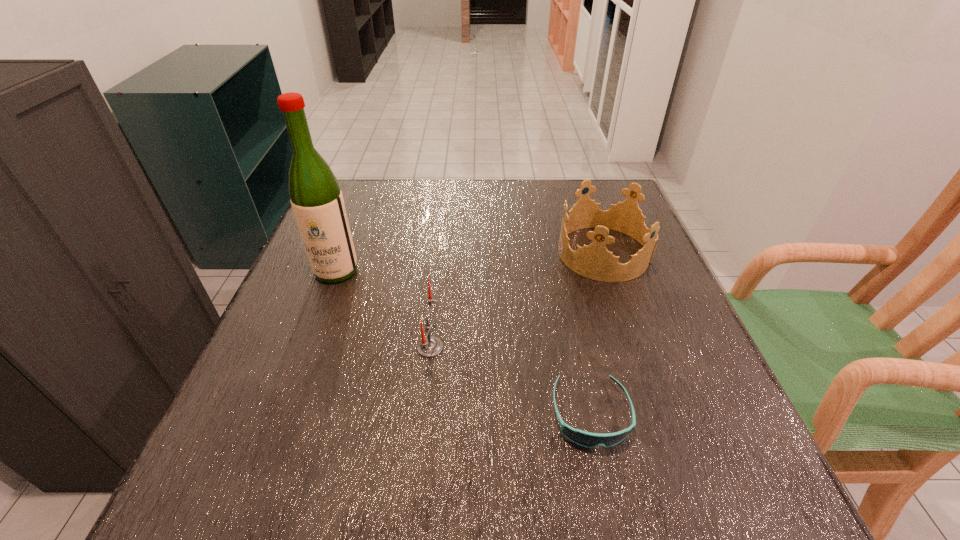
You are a GUI agent. You are given a task and a screenshot of the screen. Output one action in this format:
    pyautogui.click(x=<x>, y=<y>)
    Task: Click on the leftmost object
    Image resolution: width=960 pixels, height=540 pixels.
    Given the screenshot: What is the action you would take?
    pyautogui.click(x=315, y=195)

At what (x,y) coordinates should I click in order to perform the action: click on the tallest object. Please return your answer as a coordinate pair (x, y). The height and width of the screenshot is (540, 960). Looking at the image, I should click on (315, 195).

Locate an element on the screen. Image resolution: width=960 pixels, height=540 pixels. tiara is located at coordinates (594, 261).

I want to click on the second nearest object, so click(429, 346).

Where is `the second object from left to right`? This screenshot has width=960, height=540. the second object from left to right is located at coordinates (429, 346).

Identify the location of sunglasses. (586, 439).

At what (x,y) coordinates should I click in order to perform the action: click on the nearest object. Please return your answer as a coordinate pair (x, y). Looking at the image, I should click on (586, 439).

Where is `vacant position located 0.390m on the label of the liquor`? vacant position located 0.390m on the label of the liquor is located at coordinates (267, 454).

Locate an element on the screen. free region located 0.240m on the front-facing side of the tiara is located at coordinates (459, 253).

Locate an element on the screen. vacant point located on the front-facing side of the tiara is located at coordinates (463, 253).